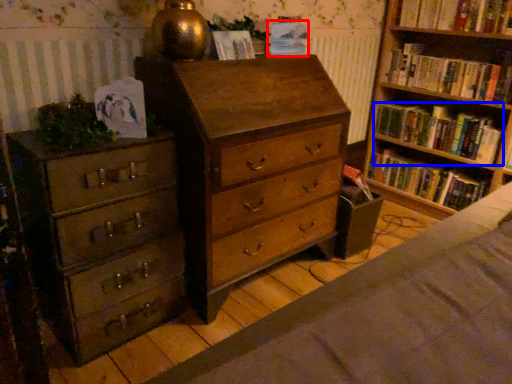
Question: Which object is further to the camera taking this photo, paperback book (highlighted by a red box) or book (highlighted by a blue box)?

Choices:
 (A) paperback book
 (B) book

Answer: (B)